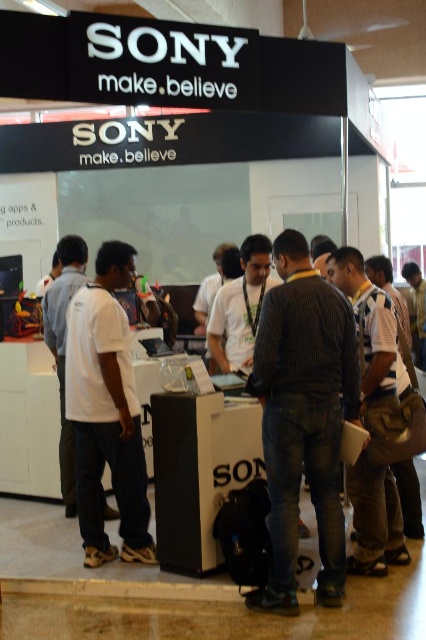
Question: Is dark striped shirt at center in front of white matte shirt at center?

Choices:
 (A) yes
 (B) no

Answer: (A)

Question: Which point is closer to the camera taking this photo?

Choices:
 (A) (325, 532)
 (B) (72, 353)

Answer: (A)

Question: Is dark striped shirt at center to the left of white matte shirt at center from the viewer's perspective?

Choices:
 (A) yes
 (B) no

Answer: (B)

Question: Among these objects, which one is farthest from the camera?

Choices:
 (A) white matte shirt at center
 (B) dark striped shirt at center

Answer: (A)

Question: Does dark striped shirt at center appear under white matte shirt at center?

Choices:
 (A) yes
 (B) no

Answer: (B)

Question: Which point appears closest to the camera in this image?

Choices:
 (A) (68, 324)
 (B) (322, 474)

Answer: (B)